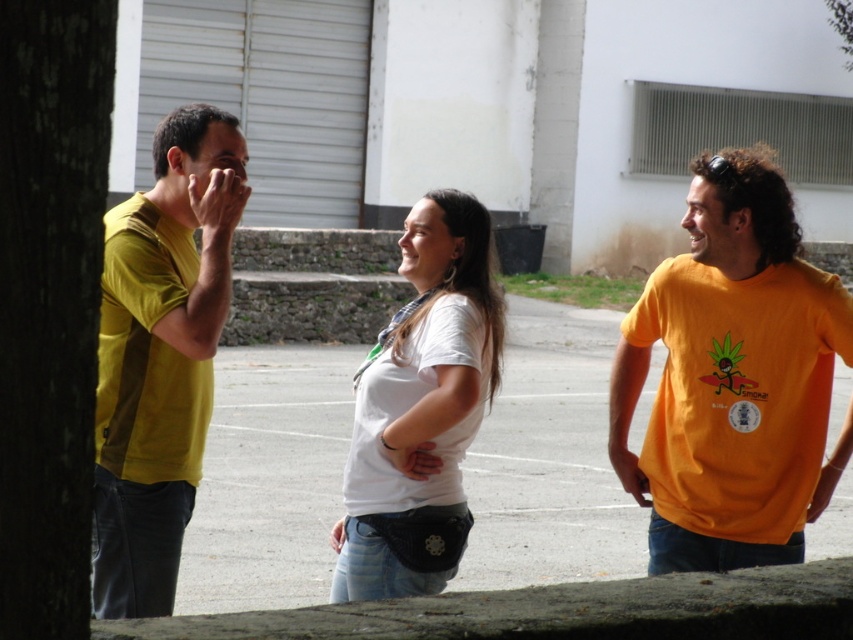
Based on the photo, you are standing in the courtyard where the two people are talking. You want to join the conversation and walk towards the white matte shirt at center. Which direction should you walk relative to the yellow matte shirt at left?

You should walk to the right of the yellow matte shirt at left to reach the white matte shirt at center since the yellow matte shirt at left is positioned to the left of the white matte shirt at center.